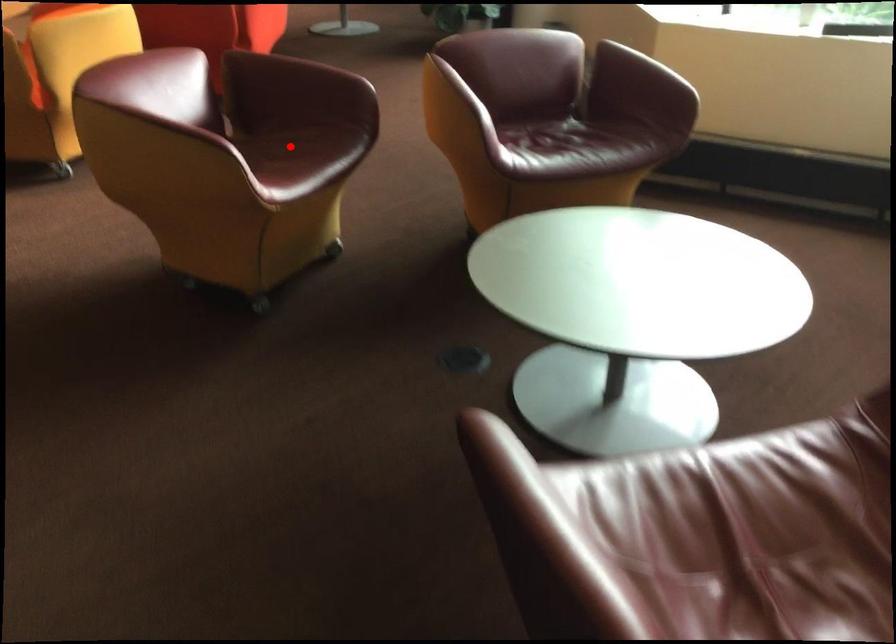
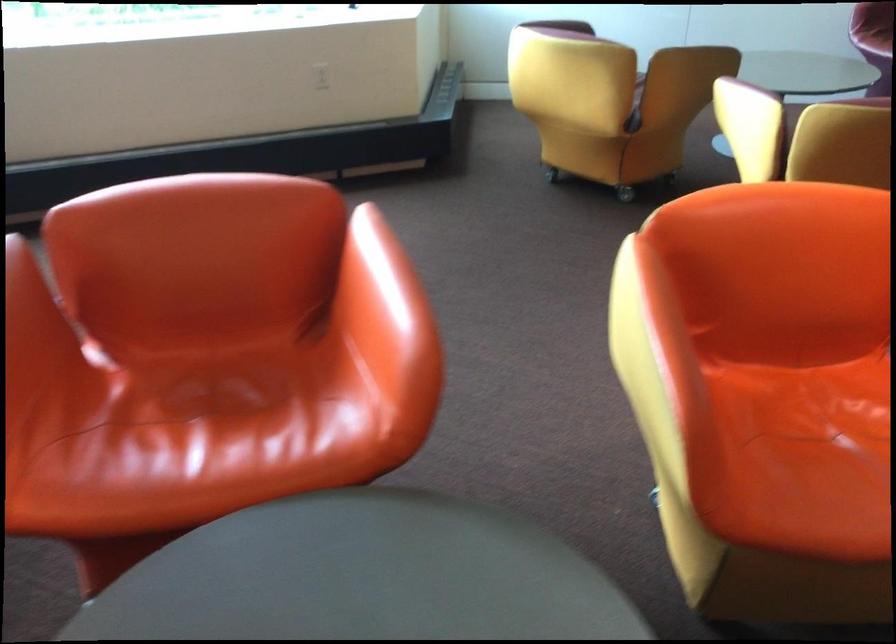
Question: I am providing you with two images of the same scene from different viewpoints. A red point is marked on the first image. Can you still see the location of the red point in image 2?

Choices:
 (A) Yes
 (B) No

Answer: (B)